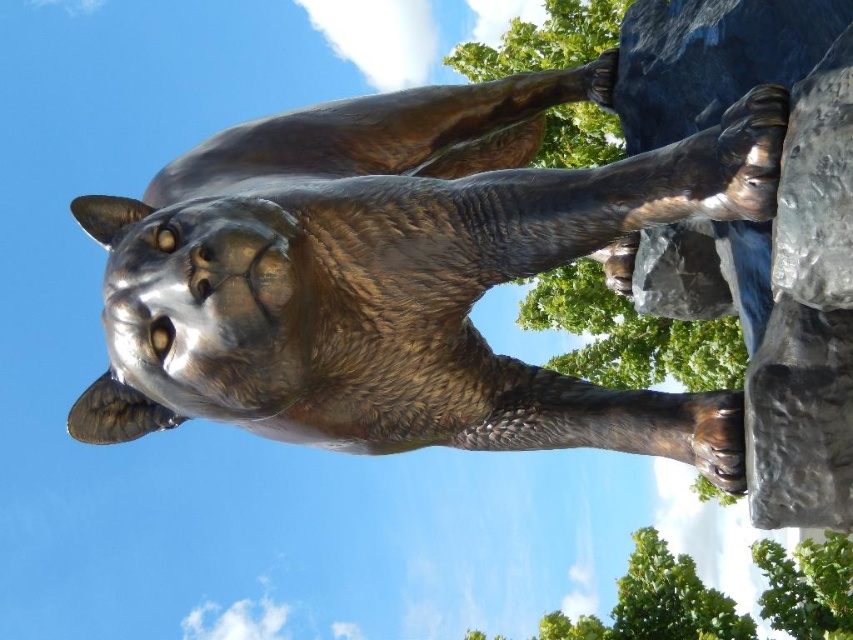
Between bronze statue at center and dark gray rough stone at upper right, which one is positioned lower?

Positioned lower is bronze statue at center.

How distant is bronze statue at center from dark gray rough stone at upper right?

The distance of bronze statue at center from dark gray rough stone at upper right is 7.08 inches.

Describe the element at coordinates (401, 273) in the screenshot. The height and width of the screenshot is (640, 853). I see `bronze statue at center` at that location.

Locate an element on the screen. This screenshot has width=853, height=640. bronze statue at center is located at coordinates (401, 273).